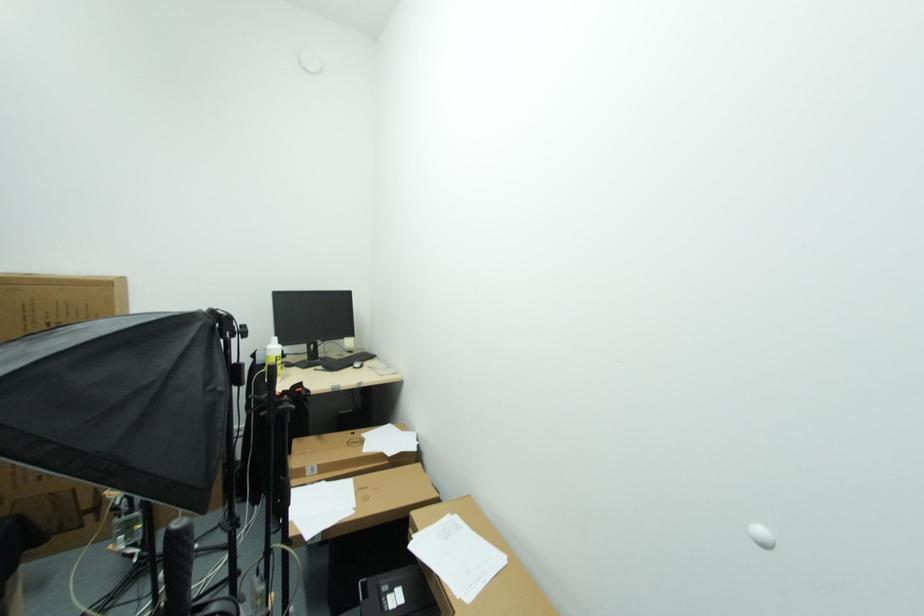
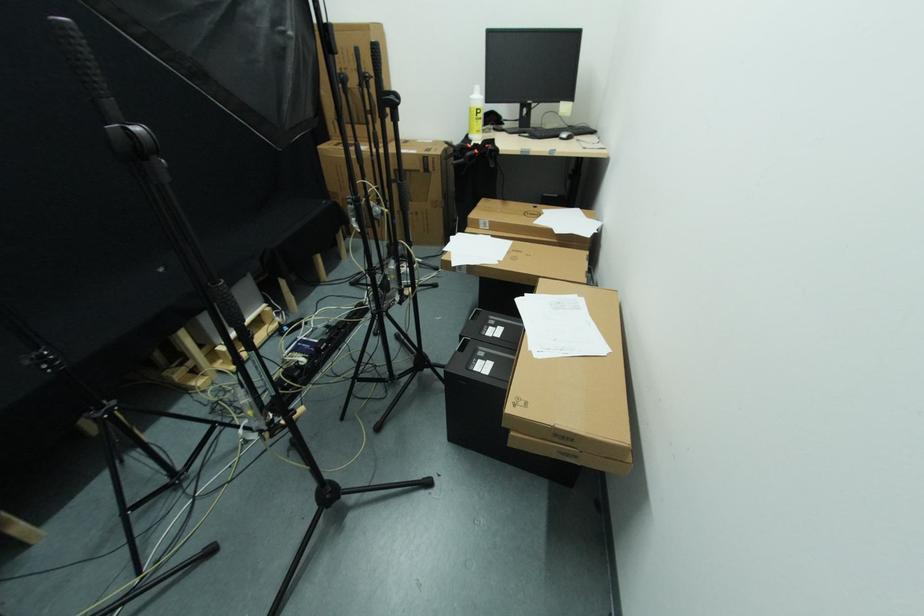
The point at (280,361) is marked in the first image. Where is the corresponding point in the second image?

(481, 114)